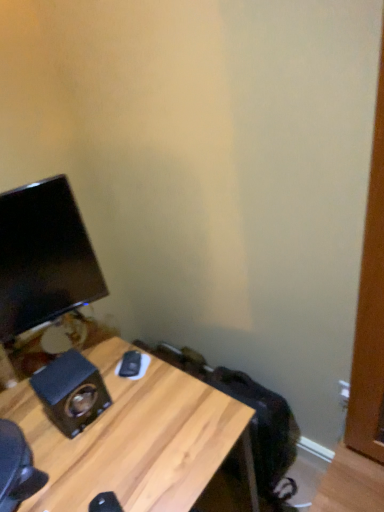
This screenshot has height=512, width=384. In order to click on free location to the left of wooden grain speaker at lower left in this screenshot , I will do `click(29, 410)`.